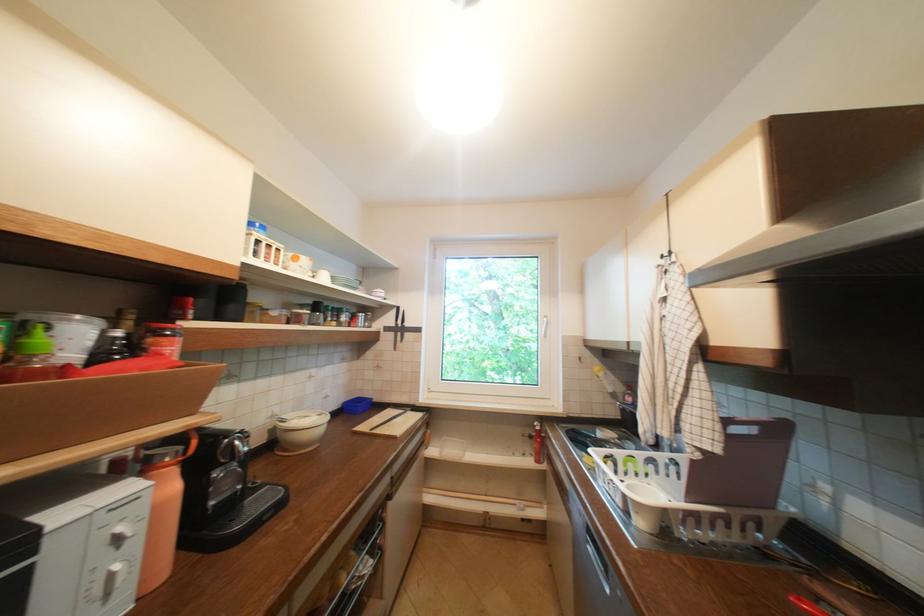
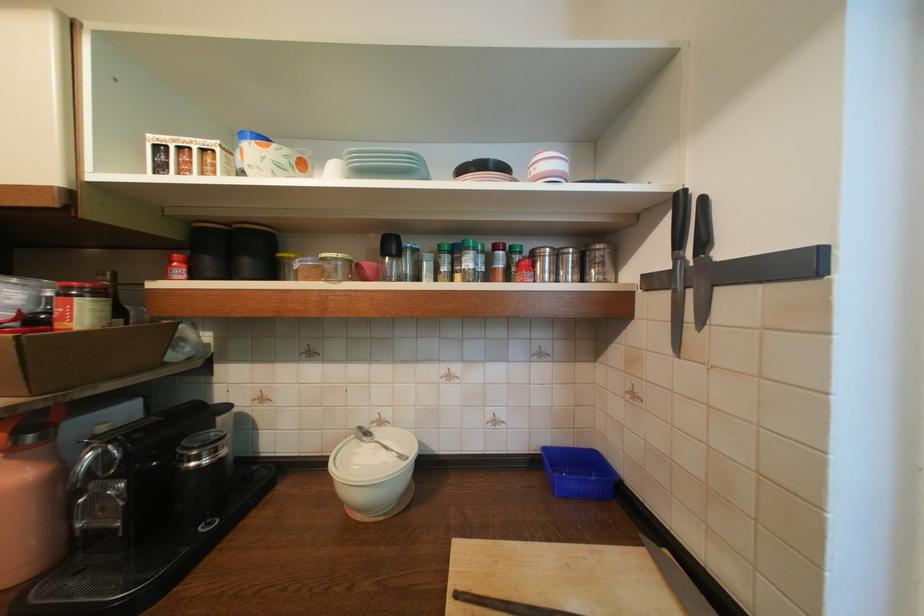
Locate, in the second image, the point that corresponds to pixel 176 334 in the first image.

(82, 294)